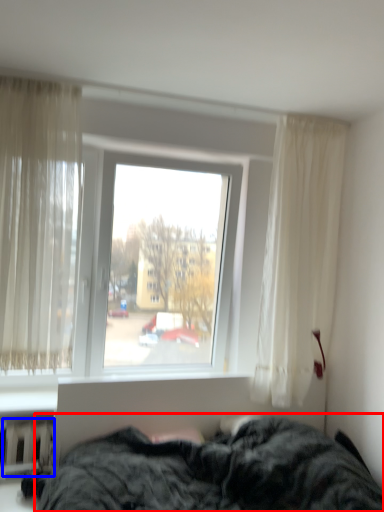
Question: Which object is further to the camera taking this photo, bed (highlighted by a red box) or radiator (highlighted by a blue box)?

Choices:
 (A) bed
 (B) radiator

Answer: (B)